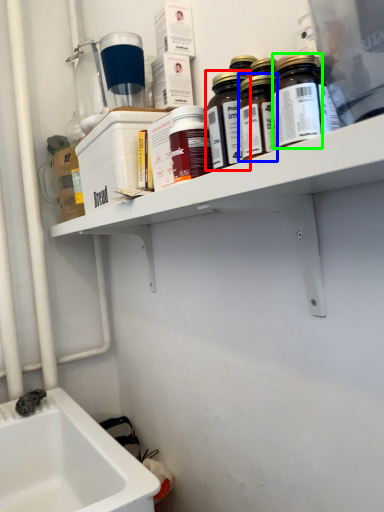
Question: Estimate the real-world distances between objects in this image. Which object is farther from bottle (highlighted by a red box), bottle (highlighted by a blue box) or bottle (highlighted by a green box)?

Choices:
 (A) bottle
 (B) bottle

Answer: (B)